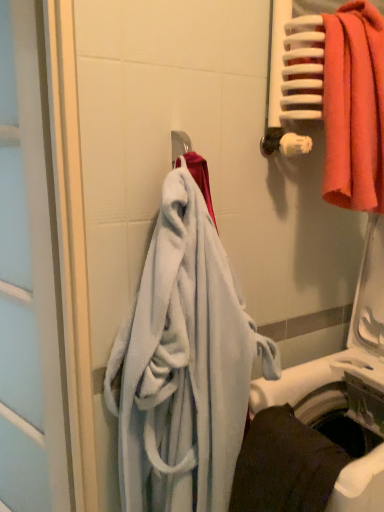
Question: From the image's perspective, would you say matte orange towel at upper right, the third towel from the bottom, is shown under dark gray fabric towel at lower right, which is counted as the first towel, starting from the bottom?

Choices:
 (A) no
 (B) yes

Answer: (A)

Question: Can you confirm if matte orange towel at upper right, marked as the first towel in a top-to-bottom arrangement, is taller than dark gray fabric towel at lower right, which is counted as the first towel, starting from the bottom?

Choices:
 (A) yes
 (B) no

Answer: (A)

Question: Is matte orange towel at upper right, marked as the first towel in a top-to-bottom arrangement, turned away from dark gray fabric towel at lower right, the 3th towel positioned from the top?

Choices:
 (A) no
 (B) yes

Answer: (A)

Question: Is matte orange towel at upper right, the third towel from the bottom, positioned behind dark gray fabric towel at lower right, the 3th towel positioned from the top?

Choices:
 (A) no
 (B) yes

Answer: (B)

Question: Is matte orange towel at upper right, the third towel from the bottom, directly adjacent to dark gray fabric towel at lower right, which is counted as the first towel, starting from the bottom?

Choices:
 (A) yes
 (B) no

Answer: (B)

Question: Is soft blue towel at center, acting as the 2th towel starting from the top, wider or thinner than white plastic washing machine at lower right?

Choices:
 (A) wide
 (B) thin

Answer: (B)

Question: In terms of size, does soft blue towel at center, acting as the 2th towel starting from the top, appear bigger or smaller than white plastic washing machine at lower right?

Choices:
 (A) big
 (B) small

Answer: (B)

Question: In terms of height, does soft blue towel at center, the 2th towel when ordered from bottom to top, look taller or shorter compared to white plastic washing machine at lower right?

Choices:
 (A) short
 (B) tall

Answer: (A)

Question: From the image's perspective, is soft blue towel at center, the 2th towel when ordered from bottom to top, located above or below white plastic washing machine at lower right?

Choices:
 (A) below
 (B) above

Answer: (B)

Question: In terms of height, does matte orange towel at upper right, marked as the first towel in a top-to-bottom arrangement, look taller or shorter compared to soft blue towel at center, acting as the 2th towel starting from the top?

Choices:
 (A) tall
 (B) short

Answer: (B)

Question: In terms of width, does matte orange towel at upper right, marked as the first towel in a top-to-bottom arrangement, look wider or thinner when compared to soft blue towel at center, acting as the 2th towel starting from the top?

Choices:
 (A) wide
 (B) thin

Answer: (B)

Question: Considering the positions of matte orange towel at upper right, marked as the first towel in a top-to-bottom arrangement, and soft blue towel at center, acting as the 2th towel starting from the top, in the image, is matte orange towel at upper right, marked as the first towel in a top-to-bottom arrangement, bigger or smaller than soft blue towel at center, acting as the 2th towel starting from the top,?

Choices:
 (A) big
 (B) small

Answer: (B)

Question: From the image's perspective, is matte orange towel at upper right, the third towel from the bottom, positioned above or below soft blue towel at center, acting as the 2th towel starting from the top?

Choices:
 (A) above
 (B) below

Answer: (A)

Question: Considering the positions of white plastic washing machine at lower right and matte orange towel at upper right, marked as the first towel in a top-to-bottom arrangement, in the image, is white plastic washing machine at lower right wider or thinner than matte orange towel at upper right, marked as the first towel in a top-to-bottom arrangement,?

Choices:
 (A) thin
 (B) wide

Answer: (B)

Question: Is point (304, 389) positioned closer to the camera than point (342, 55)?

Choices:
 (A) farther
 (B) closer

Answer: (A)